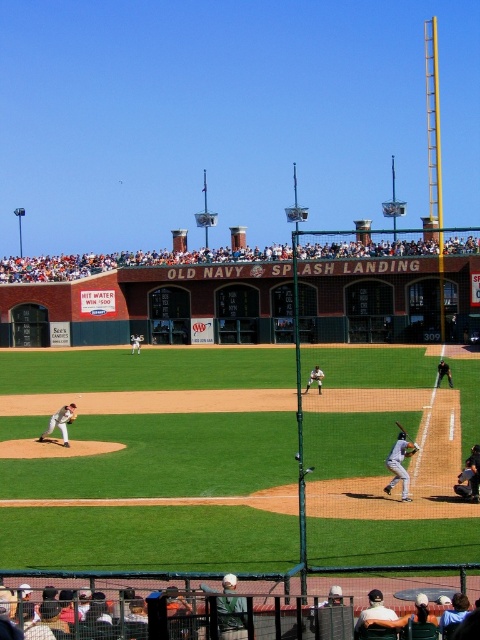
You are a baseball player standing at the matte gray uniform at center position. You need to retrieve the gray uniform bat at right which is lying on the ground. Considering the distance between them, can you reach the bat in 5 seconds if you run at a speed of 7 meters per second?

The distance between the matte gray uniform at center and the gray uniform bat at right is 23.28 meters. If you run at 7 meters per second, it would take approximately 3.32 seconds to cover that distance, so yes, you can reach the bat in 5 seconds.

In the scene shown: You are a spectator at the baseball game and want to take a photo of both the matte gray uniform at center and the green jersey baseball player at center. Since you can only focus on one subject at a time, which one should you aim your camera at first to ensure both are in the frame?

You should aim your camera at the matte gray uniform at center first because it is positioned to the left of the green jersey baseball player at center, so by focusing on the leftmost subject, both will be included in the frame.

You are a photographer positioned behind the umpire and want to capture both the matte gray uniform at center and the green jersey baseball player at center in a single photo. Which player should you adjust your camera focus to first to ensure both are in frame?

The matte gray uniform at center has a lesser width compared to green jersey baseball player at center, so you should focus on the green jersey baseball player at center first to ensure the entire width of both players fits within the frame.